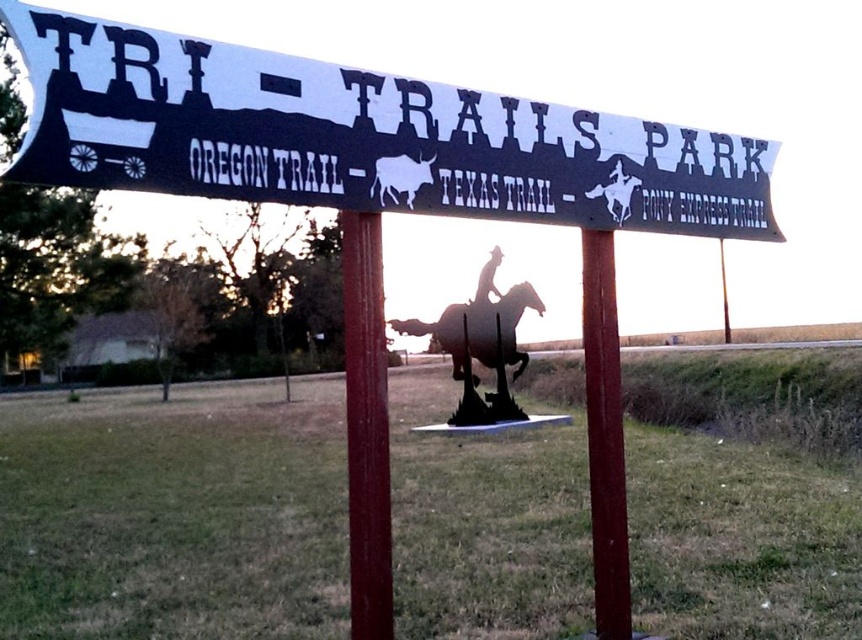
Question: Which point is farther to the camera?

Choices:
 (A) red painted wood post at center
 (B) metallic gold cowboy at center
 (C) metallic brown horse at center
 (D) black metal sign at upper center

Answer: (B)

Question: Is red painted wood post at center positioned before metallic gold cowboy at center?

Choices:
 (A) yes
 (B) no

Answer: (A)

Question: Does black metal sign at upper center have a smaller size compared to red painted wood post at center?

Choices:
 (A) yes
 (B) no

Answer: (B)

Question: Does red painted metal pole at center have a smaller size compared to metallic gold cowboy at center?

Choices:
 (A) no
 (B) yes

Answer: (A)

Question: Which is farther from the black metal sign at upper center?

Choices:
 (A) red painted wood post at center
 (B) metallic brown horse at center
 (C) red painted metal pole at center
 (D) metallic gold cowboy at center

Answer: (D)

Question: Which object appears farthest from the camera in this image?

Choices:
 (A) red painted metal pole at center
 (B) metallic brown horse at center
 (C) metallic gold cowboy at center

Answer: (C)